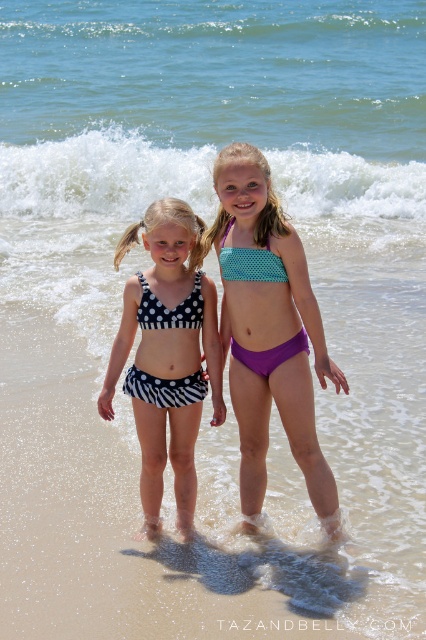
Based on the scene description, which object is positioned higher up in the image between the teal polka dot bikini top at center and the white polka dot fabric bikini at center?

The teal polka dot bikini top at center is positioned higher up in the image compared to the white polka dot fabric bikini at center, as it is located above it.